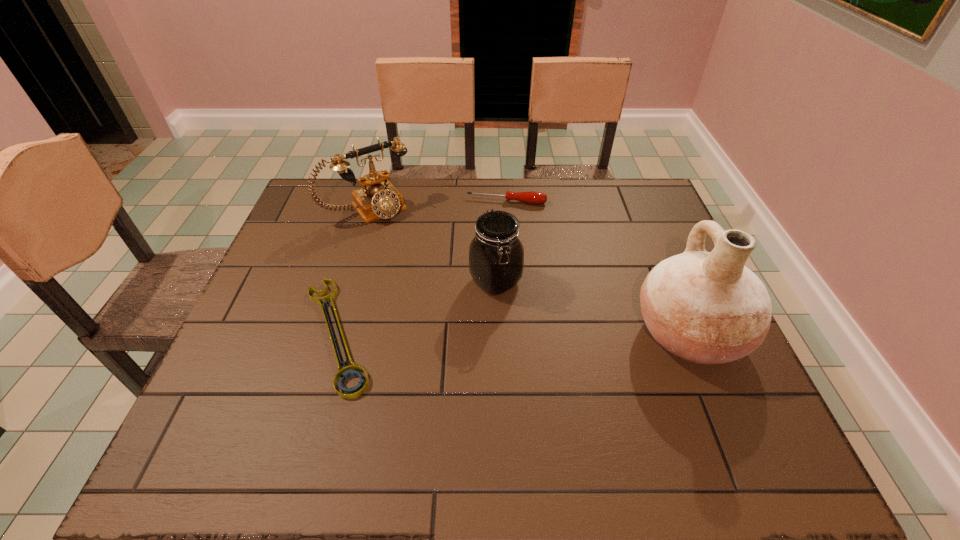
You are a GUI agent. You are given a task and a screenshot of the screen. Output one action in this format:
    pyautogui.click(x=<x>, y=<y>)
    Task: Click on the wrench that is at the left edge
    The image size is (960, 540).
    Given the screenshot: What is the action you would take?
    pyautogui.click(x=354, y=370)

At what (x,y) coordinates should I click in order to perform the action: click on telephone that is at the left edge. Please return your answer as a coordinate pair (x, y). The height and width of the screenshot is (540, 960). Looking at the image, I should click on (378, 198).

You are a GUI agent. You are given a task and a screenshot of the screen. Output one action in this format:
    pyautogui.click(x=<x>, y=<y>)
    Task: Click on the object at the right edge
    Image resolution: width=960 pixels, height=540 pixels.
    Given the screenshot: What is the action you would take?
    pyautogui.click(x=708, y=308)

Locate an element on the screen. Image resolution: width=960 pixels, height=540 pixels. object present at the far left corner is located at coordinates (378, 198).

Locate an element on the screen. This screenshot has width=960, height=540. object situated at the near left corner is located at coordinates (354, 370).

The height and width of the screenshot is (540, 960). I want to click on object located at the near right corner, so click(x=708, y=308).

Locate an element on the screen. The image size is (960, 540). vacant space at the far edge is located at coordinates (499, 192).

The height and width of the screenshot is (540, 960). I want to click on vacant space at the left edge of the desktop, so click(x=276, y=255).

In the image, there is a desktop. Identify the location of vacant space at the right edge. This screenshot has height=540, width=960. (636, 238).

The width and height of the screenshot is (960, 540). What are the coordinates of `free spot at the far left corner of the desktop` in the screenshot? It's located at (298, 224).